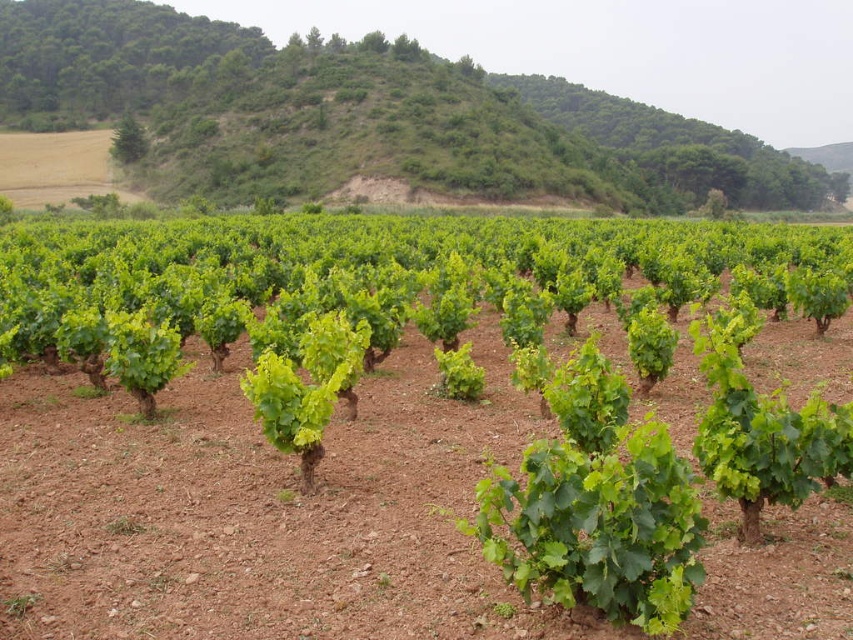
Which is more to the right, green leafy vines at center or green leafy hillside at upper center?

Positioned to the right is green leafy vines at center.

Is point (485, 317) positioned behind point (680, 189)?

No.

Image resolution: width=853 pixels, height=640 pixels. Describe the element at coordinates (288, 442) in the screenshot. I see `green leafy vines at center` at that location.

At what (x,y) coordinates should I click in order to perform the action: click on green leafy vines at center. Please return your answer as a coordinate pair (x, y). Looking at the image, I should click on tap(288, 442).